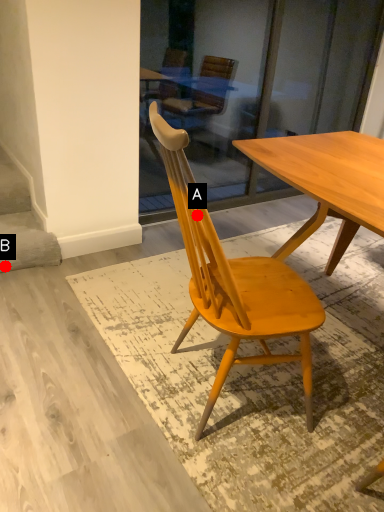
Question: Two points are circled on the image, labeled by A and B beside each circle. Which point is farther to the camera?

Choices:
 (A) A is further
 (B) B is further

Answer: (B)